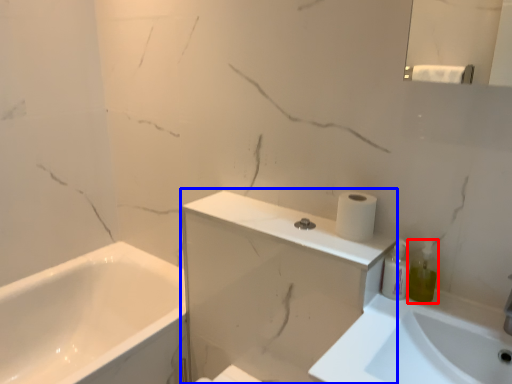
Question: Which of the following is the farthest to the observer, soap dispenser (highlighted by a red box) or medicine cabinet (highlighted by a blue box)?

Choices:
 (A) soap dispenser
 (B) medicine cabinet

Answer: (A)